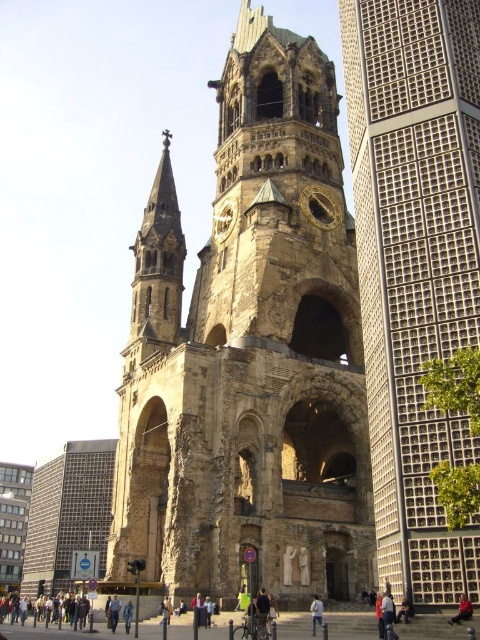
Can you confirm if gold metallic clock at center is smaller than red jacket at lower right?

Actually, gold metallic clock at center might be larger than red jacket at lower right.

Measure the distance between point (215, 228) and camera.

They are 70.11 meters apart.

You are a GUI agent. You are given a task and a screenshot of the screen. Output one action in this format:
    pyautogui.click(x=<x>, y=<y>)
    Task: Click on the gold metallic clock at center
    The width and height of the screenshot is (480, 640).
    Given the screenshot: What is the action you would take?
    pyautogui.click(x=224, y=220)

Does gray concrete tower at right appear on the left side of jeans at center?

Incorrect, gray concrete tower at right is not on the left side of jeans at center.

Does point (420, 323) come behind point (314, 618)?

No, it is in front of (314, 618).

Who is more forward, [456,285] or [316,602]?

Positioned in front is point [456,285].

This screenshot has height=640, width=480. I want to click on gray concrete tower at right, so click(x=415, y=266).

Does dark blue jeans at lower right appear under blue denim jacket at lower center?

No.

What do you see at coordinates (462, 611) in the screenshot? The height and width of the screenshot is (640, 480). I see `dark blue jeans at lower right` at bounding box center [462, 611].

Identify the location of dark blue jeans at lower right. (462, 611).